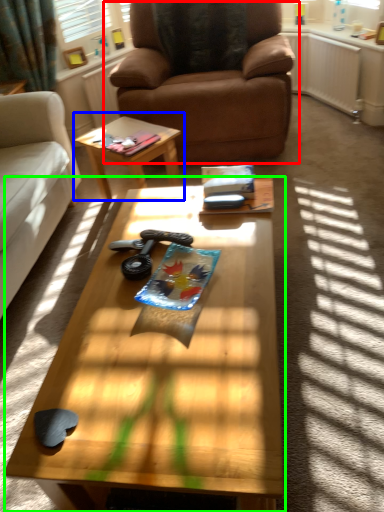
Question: Which object is the farthest from chair (highlighted by a red box)? Choose among these: coffee table (highlighted by a blue box) or coffee table (highlighted by a green box).

Choices:
 (A) coffee table
 (B) coffee table

Answer: (B)